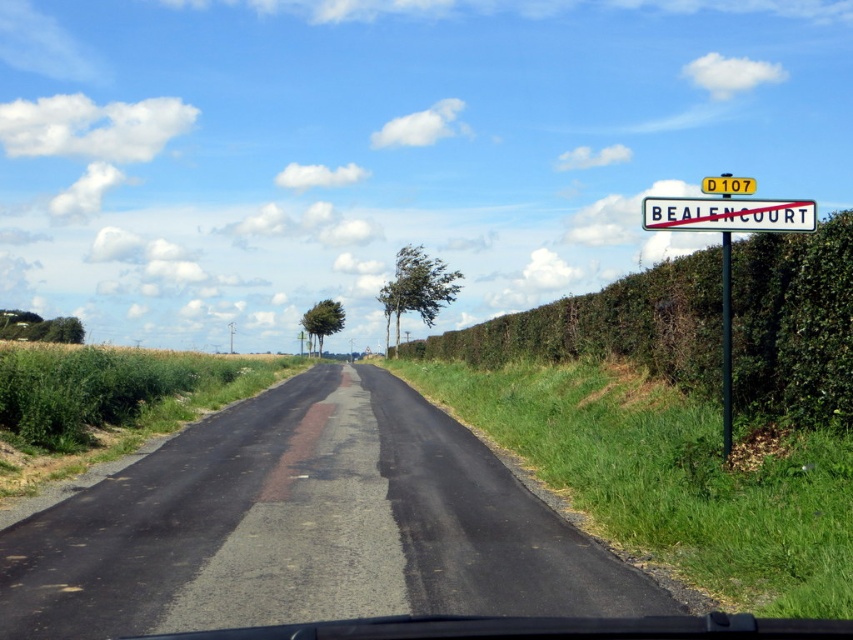
Which is more to the left, black metal signpost at upper right or yellow plastic sign at upper center?

black metal signpost at upper right

Image resolution: width=853 pixels, height=640 pixels. What do you see at coordinates (726, 342) in the screenshot?
I see `black metal signpost at upper right` at bounding box center [726, 342].

Locate an element on the screen. black metal signpost at upper right is located at coordinates (726, 342).

Between green leafy hedge at right and yellow plastic sign at upper center, which one has more height?

yellow plastic sign at upper center is taller.

Is green leafy hedge at right below yellow plastic sign at upper center?

Indeed, green leafy hedge at right is positioned under yellow plastic sign at upper center.

Is point (567, 355) farther from camera compared to point (735, 186)?

Yes.

The height and width of the screenshot is (640, 853). Identify the location of green leafy hedge at right. (793, 324).

Can you confirm if white plastic sign at upper right is positioned below yellow plastic sign at upper center?

Indeed, white plastic sign at upper right is positioned under yellow plastic sign at upper center.

Is white plastic sign at upper right further to the viewer compared to yellow plastic sign at upper center?

No, it is in front of yellow plastic sign at upper center.

Is point (723, 227) positioned behind point (744, 193)?

That is True.

The height and width of the screenshot is (640, 853). I want to click on white plastic sign at upper right, so click(728, 214).